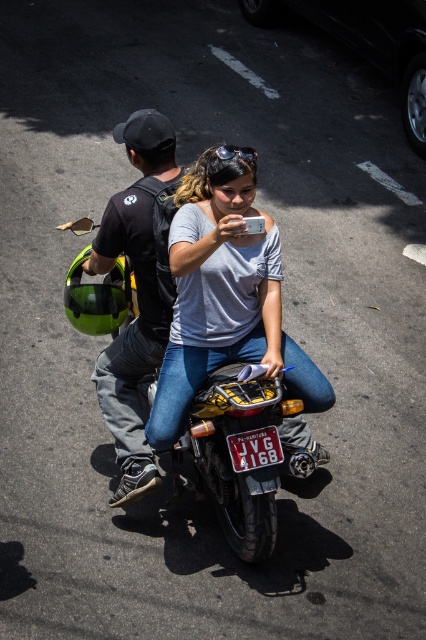
You are a pedestrian standing at the origin of the coordinate system. You see two points marked on the street. The first point is at coordinate point (236, 515) and the second point is at coordinate point (120, 461). Which point is closer to you?

Point (120, 461) is closer to you because it is behind point (236, 515), which is in front of it.

You are a pedestrian trying to cross the street and see the matte gray shirt at center and the metallic yellow motorcycle at center. Which one appears larger to you?

The matte gray shirt at center is bigger than metallic yellow motorcycle at center, so the matte gray shirt at center appears larger.